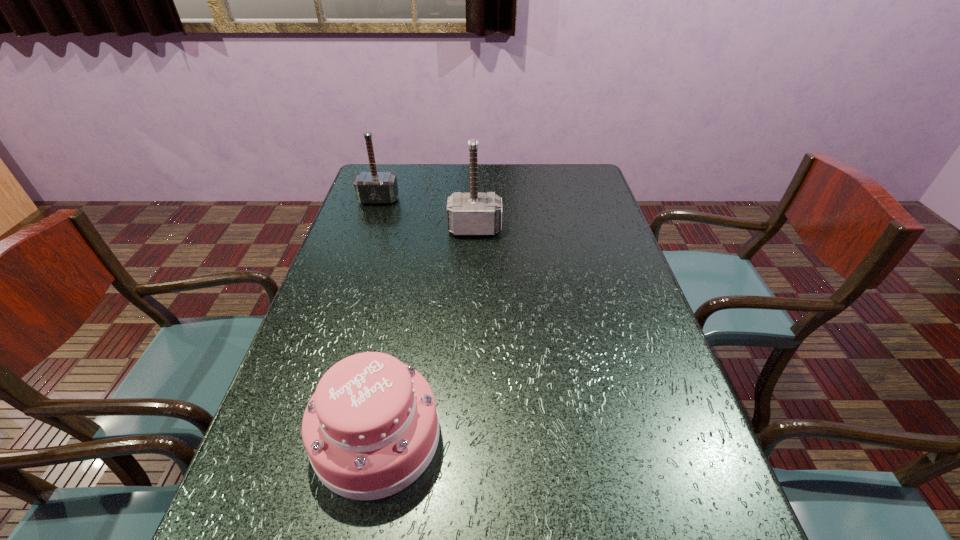
Find the location of a particular element. Image resolution: width=960 pixels, height=540 pixels. the tallest object is located at coordinates (473, 213).

Identify the location of the right hammer. Image resolution: width=960 pixels, height=540 pixels. (473, 213).

Find the location of a particular element. The height and width of the screenshot is (540, 960). the shorter hammer is located at coordinates (373, 187).

This screenshot has width=960, height=540. What are the coordinates of `the second tallest object` in the screenshot? It's located at (373, 187).

The image size is (960, 540). In order to click on the shortest object in this screenshot , I will do `click(371, 428)`.

At what (x,y) coordinates should I click in order to perform the action: click on cake. Please return your answer as a coordinate pair (x, y). Looking at the image, I should click on (371, 428).

Locate an element on the screen. The width and height of the screenshot is (960, 540). vacant space located 0.060m for striking with the head of the taller hammer is located at coordinates (474, 251).

The image size is (960, 540). What are the coordinates of `free spot located on the front of the left hammer` in the screenshot? It's located at (369, 231).

Find the location of `vacant space situated on the back of the nearest object`. vacant space situated on the back of the nearest object is located at coordinates (403, 296).

Locate an element on the screen. object located at the far edge is located at coordinates (373, 187).